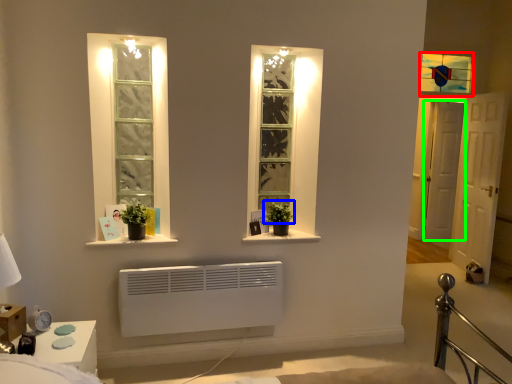
Question: Which object is the closest to the window (highlighted by a red box)? Choose among these: plant (highlighted by a blue box) or door (highlighted by a green box).

Choices:
 (A) plant
 (B) door

Answer: (B)